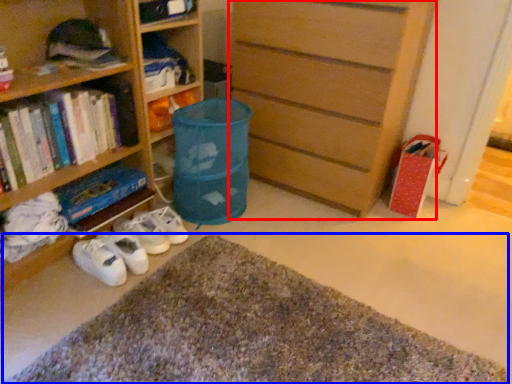
Question: Which point is closer to the camera, chest of drawers (highlighted by a red box) or doormat (highlighted by a blue box)?

Choices:
 (A) chest of drawers
 (B) doormat

Answer: (B)